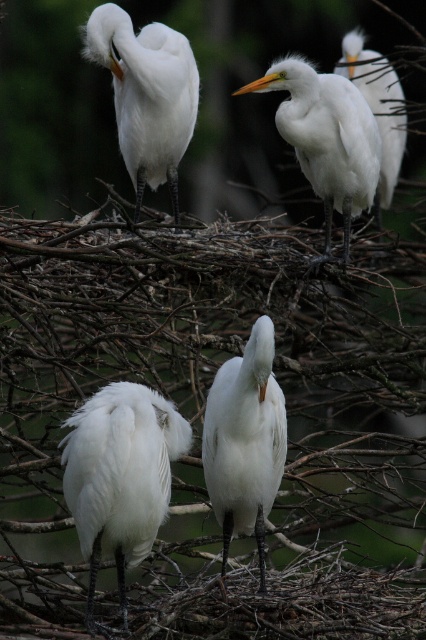
Question: Is white matte bird at center bigger than white feathered egret at upper center?

Choices:
 (A) no
 (B) yes

Answer: (A)

Question: Which is nearer to the white feathered egret at upper right?

Choices:
 (A) white fluffy bird at lower left
 (B) white matte bird at center

Answer: (B)

Question: Among these objects, which one is farthest from the camera?

Choices:
 (A) white feathered egret at upper right
 (B) white fluffy bird at lower left
 (C) white matte bird at center

Answer: (A)

Question: Is white matte bird at center to the left of white feathered egret at upper right from the viewer's perspective?

Choices:
 (A) yes
 (B) no

Answer: (A)

Question: Which of the following is the closest to the observer?

Choices:
 (A) matte white egret at upper left
 (B) white feathered egret at upper right
 (C) white matte bird at center

Answer: (C)

Question: Considering the relative positions of white fluffy bird at lower left and white matte bird at center in the image provided, where is white fluffy bird at lower left located with respect to white matte bird at center?

Choices:
 (A) right
 (B) left

Answer: (B)